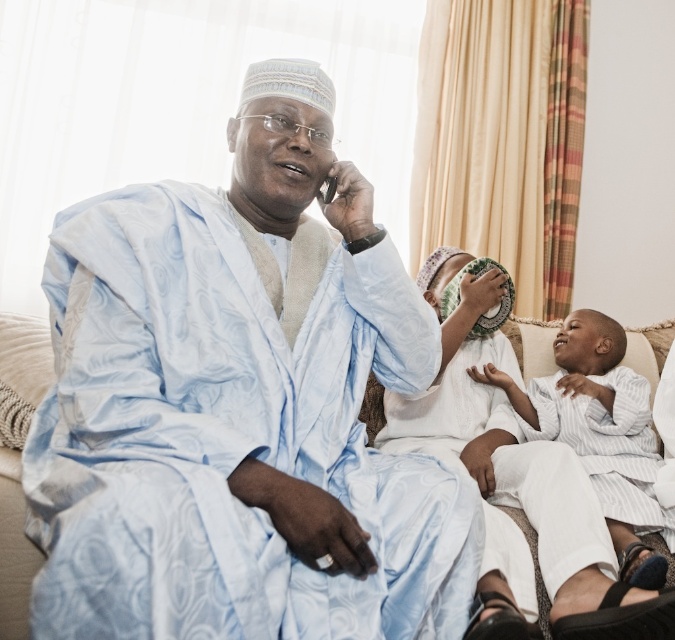
Between white striped cloth at lower right and white striped robe at lower right, which one has less height?

white striped robe at lower right is shorter.

Does white striped cloth at lower right appear on the left side of white striped robe at lower right?

Yes, white striped cloth at lower right is to the left of white striped robe at lower right.

Is point (568, 378) positioned after point (610, 380)?

No.

Identify the location of white striped cloth at lower right. This screenshot has width=675, height=640. (599, 432).

Which is more to the left, satin blue robe at center or white striped cloth at center?

satin blue robe at center is more to the left.

Which is in front, point (132, 282) or point (446, 326)?

Point (132, 282)

Locate an element on the screen. This screenshot has height=640, width=675. satin blue robe at center is located at coordinates (240, 406).

Is white striped cloth at center smaller than white striped robe at lower right?

No.

Who is positioned more to the left, white striped cloth at center or white striped robe at lower right?

Positioned to the left is white striped cloth at center.

This screenshot has width=675, height=640. I want to click on white striped cloth at center, so click(520, 493).